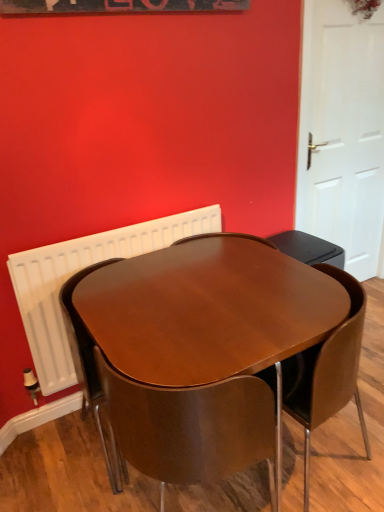
Question: From a real-world perspective, is wooden chair at center, acting as the first chair starting from the left, positioned under glossy wood table at center based on gravity?

Choices:
 (A) no
 (B) yes

Answer: (A)

Question: Is wooden chair at center, arranged as the 2th chair when viewed from the right, taller than glossy wood table at center?

Choices:
 (A) yes
 (B) no

Answer: (A)

Question: Is wooden chair at center, acting as the first chair starting from the left, thinner than glossy wood table at center?

Choices:
 (A) no
 (B) yes

Answer: (B)

Question: From the image's perspective, is wooden chair at center, acting as the first chair starting from the left, over glossy wood table at center?

Choices:
 (A) yes
 (B) no

Answer: (B)

Question: In terms of width, does wooden chair at center, arranged as the 2th chair when viewed from the right, look wider or thinner when compared to glossy wood table at center?

Choices:
 (A) wide
 (B) thin

Answer: (B)

Question: Is point (198, 440) closer or farther from the camera than point (120, 309)?

Choices:
 (A) closer
 (B) farther

Answer: (A)

Question: From their relative heights in the image, would you say wooden chair at center, arranged as the 2th chair when viewed from the right, is taller or shorter than glossy wood table at center?

Choices:
 (A) short
 (B) tall

Answer: (B)

Question: In terms of size, does wooden chair at center, arranged as the 2th chair when viewed from the right, appear bigger or smaller than glossy wood table at center?

Choices:
 (A) big
 (B) small

Answer: (B)

Question: Would you say white matte door at right is to the left or to the right of white radiator at upper left in the picture?

Choices:
 (A) right
 (B) left

Answer: (A)

Question: Looking at their shapes, would you say white matte door at right is wider or thinner than white radiator at upper left?

Choices:
 (A) thin
 (B) wide

Answer: (B)

Question: Is white matte door at right spatially inside white radiator at upper left, or outside of it?

Choices:
 (A) inside
 (B) outside

Answer: (B)

Question: From the image's perspective, is white matte door at right positioned above or below white radiator at upper left?

Choices:
 (A) above
 (B) below

Answer: (A)

Question: Considering the positions of point (29, 336) and point (299, 336), is point (29, 336) closer or farther from the camera than point (299, 336)?

Choices:
 (A) closer
 (B) farther

Answer: (B)

Question: Is white radiator at upper left to the left or to the right of glossy wood table at center in the image?

Choices:
 (A) left
 (B) right

Answer: (A)